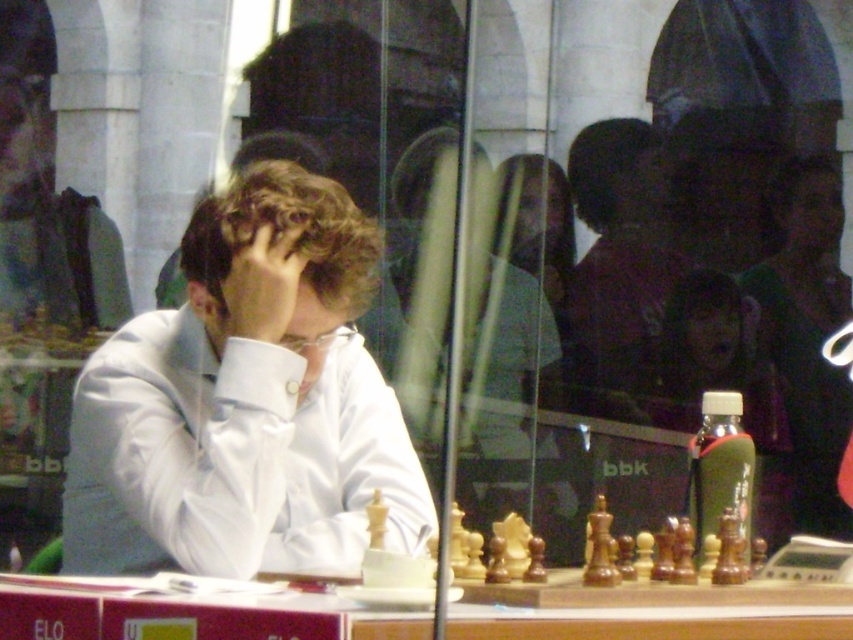
Question: Among these points, which one is farthest from the camera?

Choices:
 (A) (218, 508)
 (B) (461, 605)

Answer: (A)

Question: In this image, where is white glossy shirt at center located relative to wooden at center?

Choices:
 (A) below
 (B) above

Answer: (B)

Question: Observing the image, what is the correct spatial positioning of white glossy shirt at center in reference to wooden at center?

Choices:
 (A) left
 (B) right

Answer: (A)

Question: Is white glossy shirt at center wider than wooden at center?

Choices:
 (A) yes
 (B) no

Answer: (B)

Question: Which point is farther from the camera taking this photo?

Choices:
 (A) (527, 627)
 (B) (193, 432)

Answer: (B)

Question: Which point appears farthest from the camera in this image?

Choices:
 (A) (70, 522)
 (B) (108, 621)

Answer: (A)